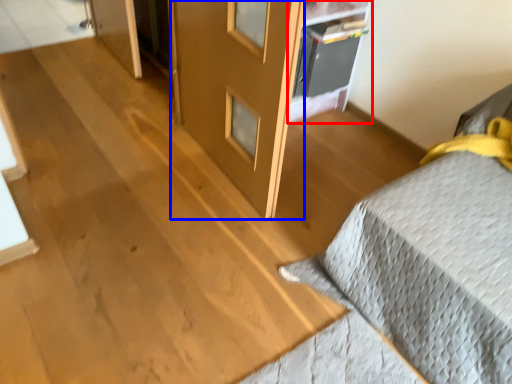
Question: Among these objects, which one is nearest to the camera, shelf (highlighted by a red box) or screen door (highlighted by a blue box)?

Choices:
 (A) shelf
 (B) screen door

Answer: (B)